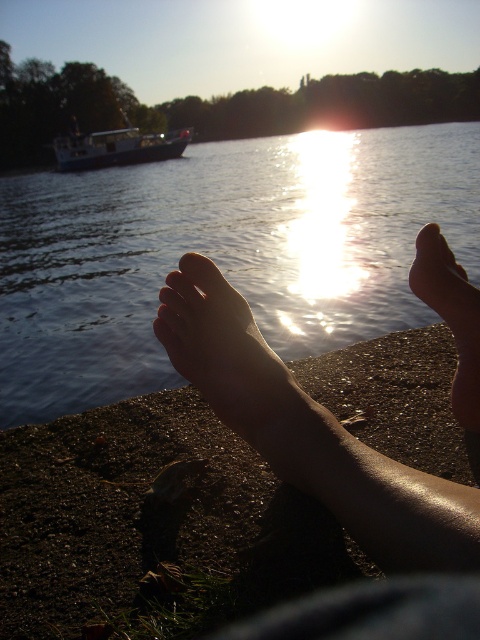
Between smooth skin foot at center and matte skin toe at center, which one is positioned higher?

matte skin toe at center is above.

At what (x,y) coordinates should I click in order to perform the action: click on smooth skin foot at center. Please return your answer as a coordinate pair (x, y). This screenshot has height=640, width=480. Looking at the image, I should click on (228, 356).

Is shiny blue water at center wider than blue matte boat at upper left?

Correct, the width of shiny blue water at center exceeds that of blue matte boat at upper left.

Where is `shiny blue water at center`? The width and height of the screenshot is (480, 640). shiny blue water at center is located at coordinates (222, 252).

Is point (84, 225) positioned after point (127, 163)?

No, (84, 225) is in front of (127, 163).

At what (x,y) coordinates should I click in order to perform the action: click on shiny blue water at center. Please return your answer as a coordinate pair (x, y). The height and width of the screenshot is (640, 480). Looking at the image, I should click on (222, 252).

Who is positioned more to the left, shiny blue water at center or smooth skin foot at lower right?

shiny blue water at center

Who is shorter, shiny blue water at center or smooth skin foot at lower right?

smooth skin foot at lower right

This screenshot has width=480, height=640. Identify the location of shiny blue water at center. (222, 252).